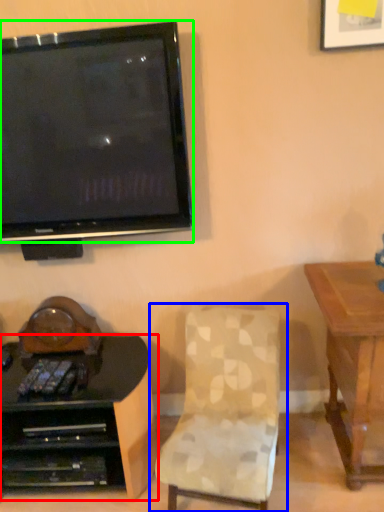
Question: Considering the real-world distances, which object is closest to desk (highlighted by a red box)? chair (highlighted by a blue box) or television (highlighted by a green box).

Choices:
 (A) chair
 (B) television

Answer: (A)